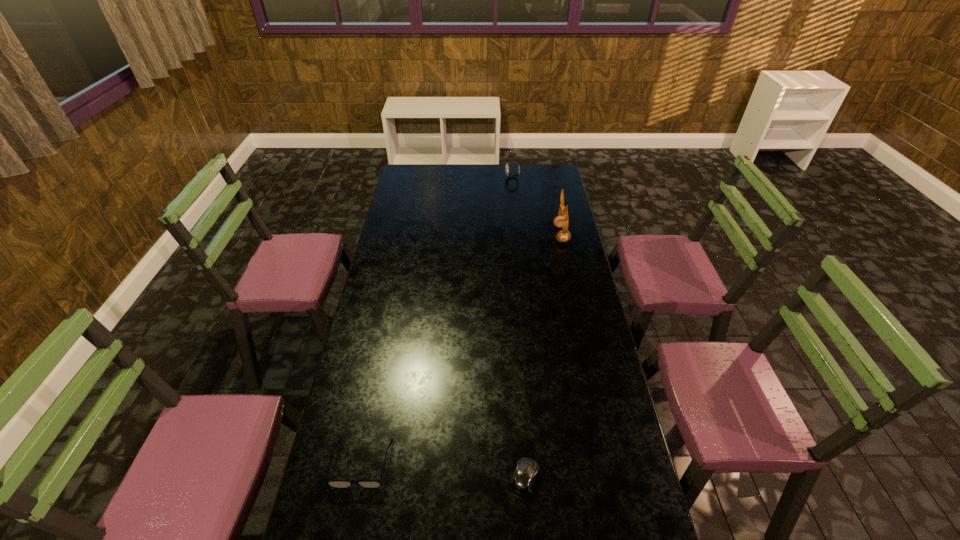
Identify the location of vacant space at the far left corner of the desktop. (426, 168).

Find the location of `free space between the third shortest object and the mouse`. free space between the third shortest object and the mouse is located at coordinates (518, 327).

This screenshot has height=540, width=960. I want to click on empty space between the rightmost object and the spectacles, so click(x=462, y=349).

This screenshot has width=960, height=540. I want to click on unoccupied area between the farthest object and the leftmost object, so click(x=437, y=320).

Where is `vacant space that is in between the second tallest object and the second farthest object`? This screenshot has width=960, height=540. vacant space that is in between the second tallest object and the second farthest object is located at coordinates (537, 206).

At what (x,y) coordinates should I click in order to perform the action: click on vacant point located between the farthest object and the spectacles. Please return your answer as a coordinate pair (x, y). The width and height of the screenshot is (960, 540). Looking at the image, I should click on (437, 320).

Locate an element on the screen. free spot between the farthest object and the mouse is located at coordinates (518, 327).

I want to click on empty space between the second tallest object and the tallest object, so click(x=537, y=206).

Identify the location of free space between the mouse and the spectacles. (x=444, y=470).

The width and height of the screenshot is (960, 540). I want to click on blank region between the leftmost object and the watch, so click(437, 320).